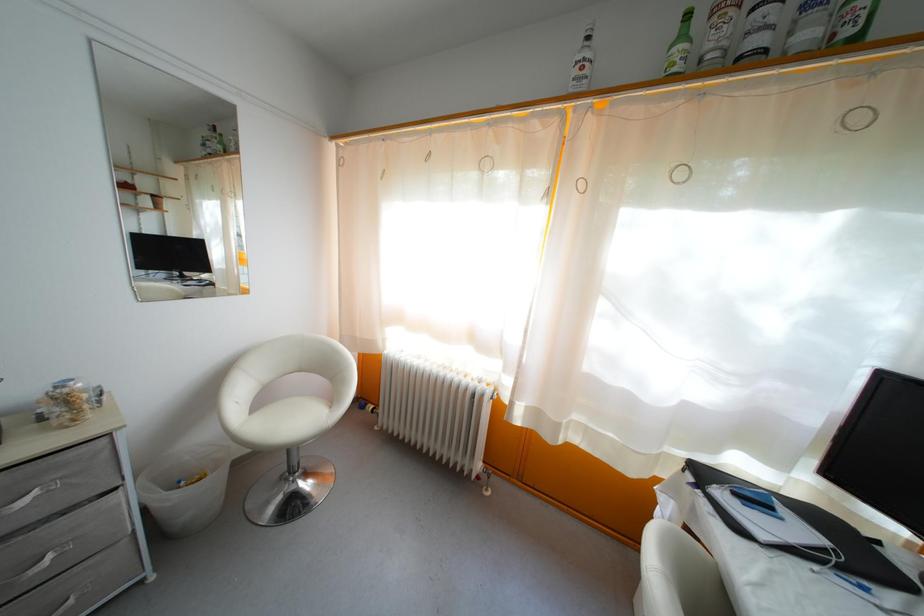
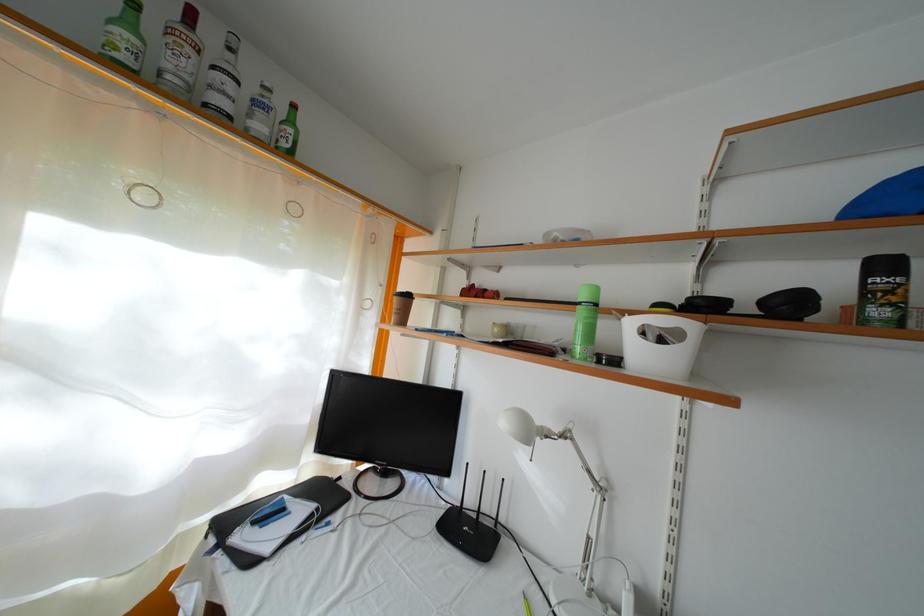
Where in the second image is the point corresponding to point 812,42 from the first image?

(264, 134)